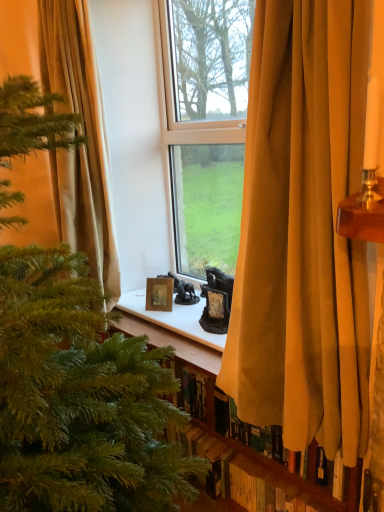
Question: Should I look upward or downward to see wooden bookshelf at lower center?

Choices:
 (A) up
 (B) down

Answer: (B)

Question: Considering the relative sizes of beige fabric curtain at left, placed as the 2th curtain when sorted from right to left, and wooden bookshelf at lower center in the image provided, is beige fabric curtain at left, placed as the 2th curtain when sorted from right to left, bigger than wooden bookshelf at lower center?

Choices:
 (A) yes
 (B) no

Answer: (A)

Question: From the image's perspective, does beige fabric curtain at left, placed as the 2th curtain when sorted from right to left, appear higher than wooden bookshelf at lower center?

Choices:
 (A) no
 (B) yes

Answer: (B)

Question: Considering the relative positions of beige fabric curtain at left, the first curtain when ordered from left to right, and wooden bookshelf at lower center in the image provided, is beige fabric curtain at left, the first curtain when ordered from left to right, to the right of wooden bookshelf at lower center from the viewer's perspective?

Choices:
 (A) no
 (B) yes

Answer: (A)

Question: Can you confirm if beige fabric curtain at left, arranged as the 1th curtain when viewed from the back, is positioned to the left of wooden bookshelf at lower center?

Choices:
 (A) yes
 (B) no

Answer: (A)

Question: From a real-world perspective, is beige fabric curtain at left, the first curtain when ordered from left to right, located higher than wooden bookshelf at lower center?

Choices:
 (A) no
 (B) yes

Answer: (B)

Question: Considering the relative sizes of beige fabric curtain at left, the first curtain when ordered from left to right, and wooden bookshelf at lower center in the image provided, is beige fabric curtain at left, the first curtain when ordered from left to right, thinner than wooden bookshelf at lower center?

Choices:
 (A) no
 (B) yes

Answer: (A)

Question: Is wooden bookshelf at lower center at the left side of wooden photo frame at center?

Choices:
 (A) no
 (B) yes

Answer: (A)

Question: Is wooden bookshelf at lower center aimed at wooden photo frame at center?

Choices:
 (A) no
 (B) yes

Answer: (A)

Question: Can you confirm if wooden bookshelf at lower center is wider than wooden photo frame at center?

Choices:
 (A) yes
 (B) no

Answer: (A)

Question: Is wooden bookshelf at lower center further to camera compared to wooden photo frame at center?

Choices:
 (A) no
 (B) yes

Answer: (A)

Question: From the image's perspective, is wooden bookshelf at lower center located above wooden photo frame at center?

Choices:
 (A) yes
 (B) no

Answer: (B)

Question: Does wooden bookshelf at lower center appear on the right side of wooden photo frame at center?

Choices:
 (A) yes
 (B) no

Answer: (A)

Question: Is the depth of velvet gold curtain at center, which is counted as the 2th curtain, starting from the left, less than that of green matte christmas tree at left?

Choices:
 (A) no
 (B) yes

Answer: (A)